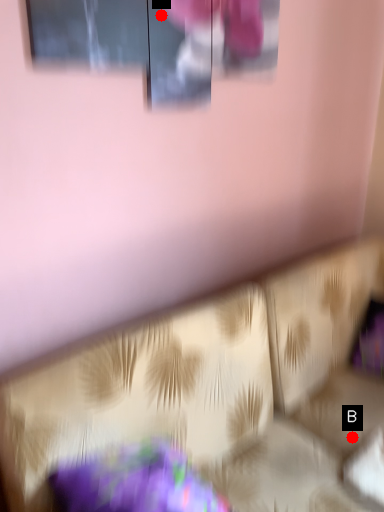
Question: Two points are circled on the image, labeled by A and B beside each circle. Which point is closer to the camera?

Choices:
 (A) A is closer
 (B) B is closer

Answer: (A)